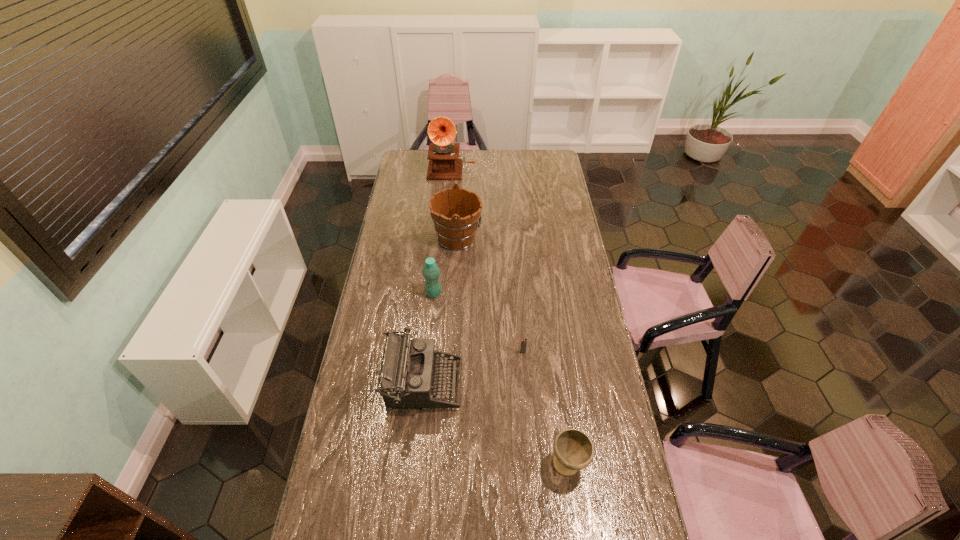
Identify the location of vacant point that satisfies the following two spatial constraints: 1. on the horn of the tallest object; 2. on the right side of the igniter. The height and width of the screenshot is (540, 960). (437, 352).

The width and height of the screenshot is (960, 540). I want to click on blank area in the image that satisfies the following two spatial constraints: 1. at the front cap of the fourth nearest object; 2. on the back side of the rightmost object, so click(417, 464).

Identify the location of free spot that satisfies the following two spatial constraints: 1. on the typing side of the nearest object; 2. on the right side of the typewriter. (415, 464).

Where is `vacant space that satisfies the following two spatial constraints: 1. on the horn of the farthest object; 2. at the front cap of the third farthest object`? vacant space that satisfies the following two spatial constraints: 1. on the horn of the farthest object; 2. at the front cap of the third farthest object is located at coordinates [x=442, y=293].

What are the coordinates of `vacant point that satisfies the following two spatial constraints: 1. on the horn of the igniter; 2. on the left side of the phonograph record` in the screenshot? It's located at (437, 352).